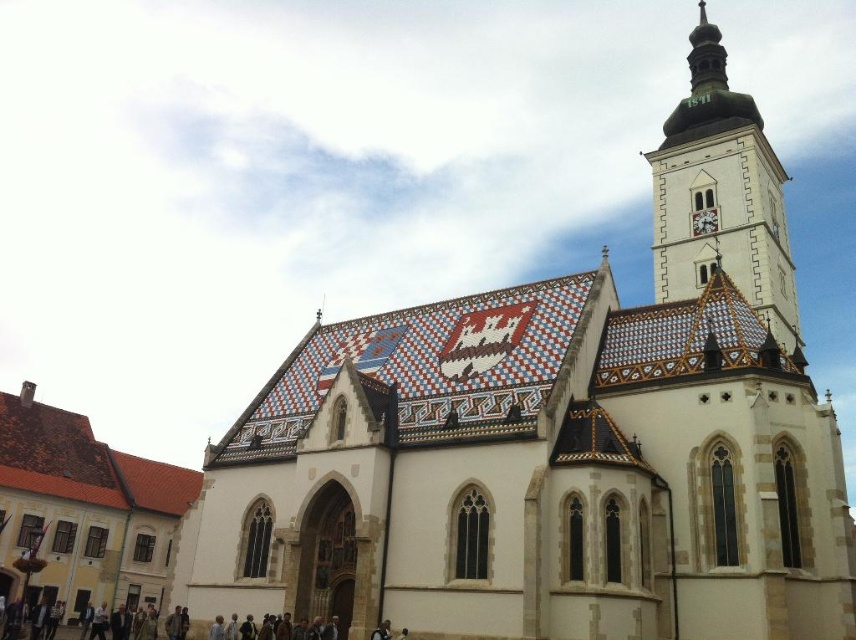
You are standing in front of the church and want to take a photo of the point at coordinates point [688,65]. If your camera has a maximum focus range of 150 meters, will it be able to focus on that point?

The distance of point [688,65] from viewer is 144.34 meters, so yes, the camera can focus on that point since it is within the 150 meters range.

You are an architect examining the church from the front. You notice the white tiled tower at upper right and the white textured clock at upper center. Which object is located higher up in the image?

The white tiled tower at upper right is positioned over the white textured clock at upper center, so it is higher up in the image.

You are an architect analyzing the church structure. You notice the white tiled tower at upper right and the white textured clock at upper center. Which of these two objects is located to the right of the other?

The white tiled tower at upper right is positioned on the right side of the white textured clock at upper center.